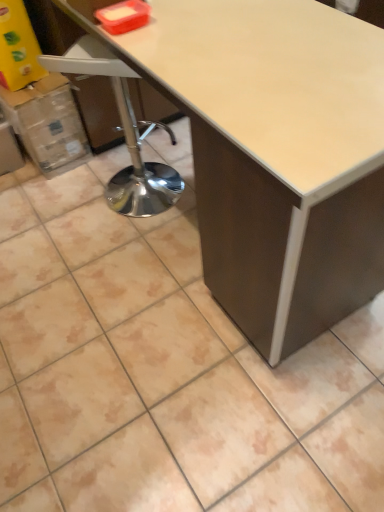
I want to click on free spot in front of matte white table at center, so click(x=201, y=398).